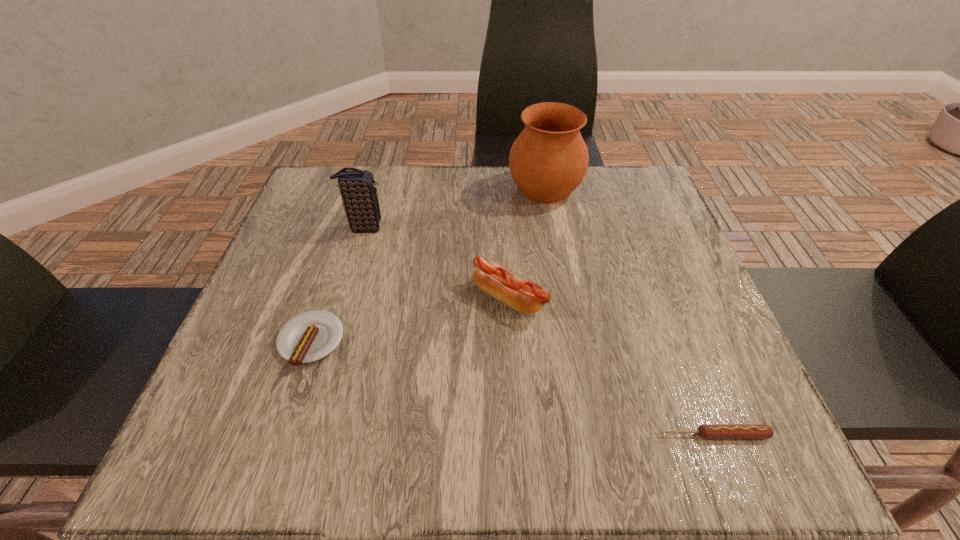
Locate an element on the screen. object that is positioned at the right edge is located at coordinates (707, 431).

Identify the location of object that is at the far left corner. This screenshot has height=540, width=960. (357, 187).

Identify the location of object situated at the near right corner. (707, 431).

At what (x,y) coordinates should I click in order to perform the action: click on vacant space at the far edge. Please return your answer as a coordinate pair (x, y). This screenshot has width=960, height=540. Looking at the image, I should click on (482, 200).

At what (x,y) coordinates should I click in order to perform the action: click on blank space at the near edge of the desktop. Please return your answer as a coordinate pair (x, y). The image size is (960, 540). Looking at the image, I should click on (397, 417).

Image resolution: width=960 pixels, height=540 pixels. I want to click on vacant space at the left edge of the desktop, so click(x=331, y=295).

The width and height of the screenshot is (960, 540). In the image, there is a desktop. Find the location of `vacant region at the right edge`. vacant region at the right edge is located at coordinates (721, 404).

This screenshot has width=960, height=540. Identify the location of vacant space at the far left corner. (313, 176).

Find the location of a particular element. empty space between the fourth nearest object and the pottery is located at coordinates (455, 208).

In order to click on empty space between the nearest object and the second sausage from right to left in this screenshot , I will do `click(612, 366)`.